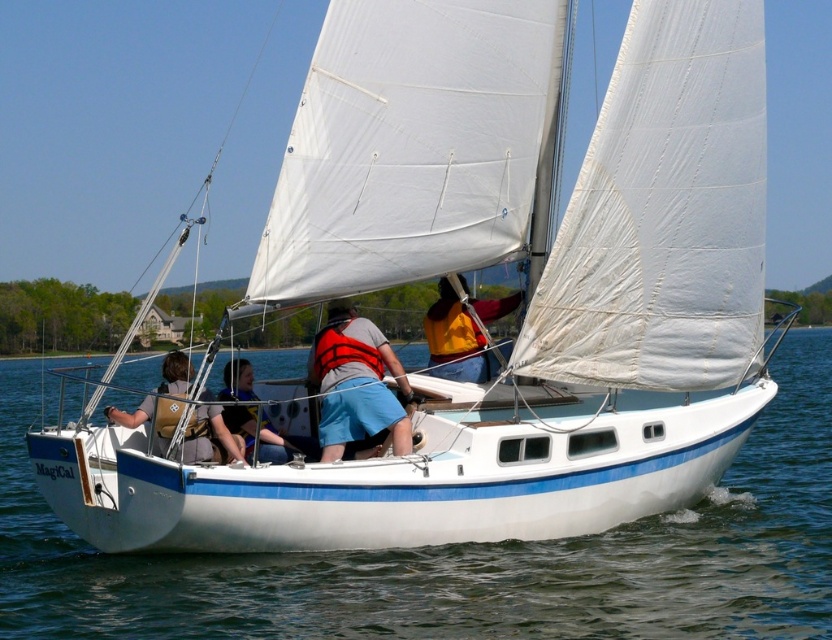
Question: Which point appears closest to the camera in this image?

Choices:
 (A) (184, 392)
 (B) (226, 420)
 (C) (47, 592)
 (D) (340, 449)

Answer: (A)

Question: Does orange life vest at center have a larger size compared to brown leather life vest at center?

Choices:
 (A) no
 (B) yes

Answer: (A)

Question: Which object appears farthest from the camera in this image?

Choices:
 (A) orange life vest at center
 (B) orange fabric at center

Answer: (B)

Question: Is blue water at center bigger than orange fabric at center?

Choices:
 (A) yes
 (B) no

Answer: (A)

Question: Can you confirm if orange life vest at center is positioned below brown leather life vest at center?

Choices:
 (A) no
 (B) yes

Answer: (A)

Question: Estimate the real-world distances between objects in this image. Which object is closer to the yellow life vest at center?

Choices:
 (A) blue water at center
 (B) orange life vest at center
 (C) orange fabric at center
 (D) brown leather life vest at center

Answer: (D)